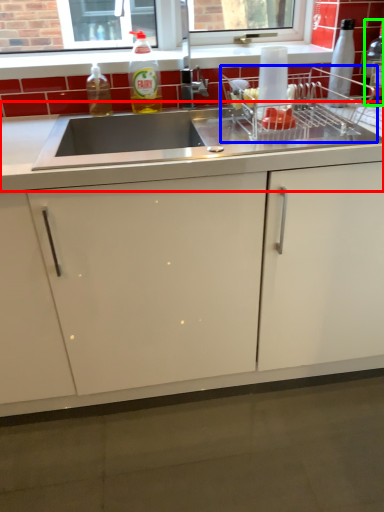
Question: Which object is the farthest from countertop (highlighted by a red box)? Choose among these: appliance (highlighted by a blue box) or bottle (highlighted by a green box).

Choices:
 (A) appliance
 (B) bottle

Answer: (B)